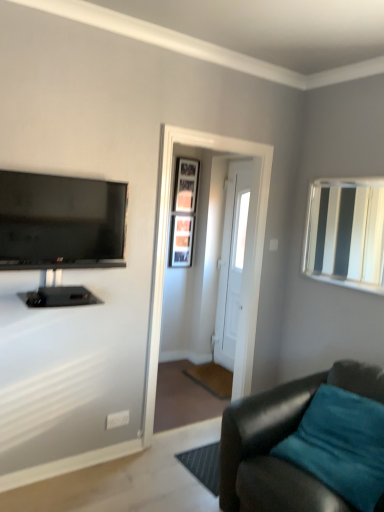
What do you see at coordinates (61, 222) in the screenshot?
I see `matte black tv at upper left` at bounding box center [61, 222].

You are a GUI agent. You are given a task and a screenshot of the screen. Output one action in this format:
    pyautogui.click(x=<x>, y=<y>)
    Task: Click on the teal leather couch at lower right
    
    Given the screenshot: What is the action you would take?
    pyautogui.click(x=281, y=440)

In order to face white glossy mirror at upper right, should I rotate leftwards or rightwards?

Turn right by 19.739 degrees to look at white glossy mirror at upper right.

Where is `white wooden door at center`? This screenshot has height=512, width=384. white wooden door at center is located at coordinates (232, 261).

You are a GUI agent. You are given a task and a screenshot of the screen. Output one action in this format:
    pyautogui.click(x=<x>, y=<y>)
    Task: Click on the matte black tv at upper left
    Image resolution: width=384 pixels, height=512 pixels.
    Given the screenshot: What is the action you would take?
    pyautogui.click(x=61, y=222)

You are a GUI agent. You are given a task and a screenshot of the screen. Output one action in this format:
    pyautogui.click(x=<x>, y=<y>)
    Task: Click on the screen door lying on the left of white glossy mirror at upper right
    The width and height of the screenshot is (384, 512).
    Given the screenshot: What is the action you would take?
    pyautogui.click(x=166, y=251)

Which is in front, point (153, 298) or point (383, 232)?

The point (153, 298) is closer.

Is white glossy door at center positioned beyond the bounds of white glossy mirror at upper right?

Yes, white glossy door at center is outside of white glossy mirror at upper right.

In the scene shown: Considering the sizes of objects white glossy door at center and white glossy mirror at upper right in the image provided, who is thinner, white glossy door at center or white glossy mirror at upper right?

white glossy mirror at upper right.

How far apart are teal leather couch at lower right and matte black tv at upper left?

teal leather couch at lower right is 1.30 meters away from matte black tv at upper left.

Is teal leather couch at lower right bigger than matte black tv at upper left?

Correct, teal leather couch at lower right is larger in size than matte black tv at upper left.

Locate an element on the screen. This screenshot has width=384, height=512. television above the teal leather couch at lower right (from a real-world perspective) is located at coordinates (61, 222).

Is wooden framed picture at center, which is the 2th picture frame in bottom-to-top order, directly adjacent to wooden picture frame at center, positioned as the first picture frame in bottom-to-top order?

No, wooden framed picture at center, which is the 2th picture frame in bottom-to-top order, is not making contact with wooden picture frame at center, positioned as the first picture frame in bottom-to-top order.

Which of these two, wooden framed picture at center, which is the 2th picture frame in bottom-to-top order, or wooden picture frame at center, positioned as the first picture frame in bottom-to-top order, stands taller?

wooden picture frame at center, positioned as the first picture frame in bottom-to-top order, is taller.

Is wooden framed picture at center, the 1th picture frame from the top, inside the boundaries of wooden picture frame at center, positioned as the first picture frame in bottom-to-top order, or outside?

wooden framed picture at center, the 1th picture frame from the top, is not inside wooden picture frame at center, positioned as the first picture frame in bottom-to-top order, it's outside.

From the image's perspective, is wooden framed picture at center, the 1th picture frame from the top, above or below wooden picture frame at center, which is the 2th picture frame from top to bottom?

Based on their image positions, wooden framed picture at center, the 1th picture frame from the top, is located above wooden picture frame at center, which is the 2th picture frame from top to bottom.

Is point (181, 179) closer or farther from the camera than point (311, 203)?

Clearly, point (181, 179) is more distant from the camera than point (311, 203).

How many degrees apart are the facing directions of wooden framed picture at center, which is the 2th picture frame in bottom-to-top order, and white glossy mirror at upper right?

91.1 degrees separate the facing orientations of wooden framed picture at center, which is the 2th picture frame in bottom-to-top order, and white glossy mirror at upper right.

Would you consider wooden framed picture at center, the 1th picture frame from the top, to be distant from white glossy mirror at upper right?

wooden framed picture at center, the 1th picture frame from the top, is positioned a significant distance from white glossy mirror at upper right.

Is wooden framed picture at center, which is the 2th picture frame in bottom-to-top order, positioned with its back to white glossy mirror at upper right?

No.

Considering the relative positions of white wooden door at center and white glossy mirror at upper right in the image provided, is white wooden door at center to the left or to the right of white glossy mirror at upper right?

Clearly, white wooden door at center is on the left of white glossy mirror at upper right in the image.

Is white wooden door at center oriented away from white glossy mirror at upper right?

No.

Is white glossy mirror at upper right located within white wooden door at center?

Definitely not — white glossy mirror at upper right is not inside white wooden door at center.

Does point (227, 263) come farther from viewer compared to point (321, 203)?

Yes, point (227, 263) is behind point (321, 203).

Is wooden framed picture at center, which is the 2th picture frame in bottom-to-top order, next to teal leather couch at lower right?

No.

From the image's perspective, which is above, wooden framed picture at center, which is the 2th picture frame in bottom-to-top order, or teal leather couch at lower right?

From the image's view, wooden framed picture at center, which is the 2th picture frame in bottom-to-top order, is above.

Between wooden framed picture at center, the 1th picture frame from the top, and teal leather couch at lower right, which one has larger width?

teal leather couch at lower right.

Visually, is wooden framed picture at center, which is the 2th picture frame in bottom-to-top order, positioned to the left or to the right of teal leather couch at lower right?

In the image, wooden framed picture at center, which is the 2th picture frame in bottom-to-top order, appears on the left side of teal leather couch at lower right.

From a real-world perspective, is teal leather couch at lower right positioned under white glossy mirror at upper right based on gravity?

Yes, from a real-world perspective, teal leather couch at lower right is under white glossy mirror at upper right.

How many degrees apart are the facing directions of teal leather couch at lower right and white glossy mirror at upper right?

The facing directions of teal leather couch at lower right and white glossy mirror at upper right are 4.48 degrees apart.

Between point (323, 375) and point (369, 289), which one is positioned in front?

The point (323, 375) is closer.

Is teal leather couch at lower right facing away from white glossy mirror at upper right?

No, teal leather couch at lower right is not facing away from white glossy mirror at upper right.

I want to click on mirror above the white glossy door at center (from the image's perspective), so click(346, 233).

Where is `studio couch located in front of the matte black tv at upper left`? studio couch located in front of the matte black tv at upper left is located at coordinates (281, 440).

Considering their positions, is wooden picture frame at center, positioned as the first picture frame in bottom-to-top order, positioned further to teal leather couch at lower right than white glossy door at center?

wooden picture frame at center, positioned as the first picture frame in bottom-to-top order, is further to teal leather couch at lower right.

When comparing their distances from white glossy door at center, does white wooden door at center or matte black tv at upper left seem further?

white wooden door at center is further to white glossy door at center.

Estimate the real-world distances between objects in this image. Which object is closer to matte black tv at upper left, teal leather couch at lower right or wooden framed picture at center, which is the 2th picture frame in bottom-to-top order?

teal leather couch at lower right is positioned closer to the anchor matte black tv at upper left.

Based on their spatial positions, is white glossy mirror at upper right or white wooden door at center further from wooden picture frame at center, which is the 2th picture frame from top to bottom?

Based on the image, white glossy mirror at upper right appears to be further to wooden picture frame at center, which is the 2th picture frame from top to bottom.

Estimate the real-world distances between objects in this image. Which object is further from teal leather couch at lower right, wooden framed picture at center, the 1th picture frame from the top, or matte black tv at upper left?

The object further to teal leather couch at lower right is wooden framed picture at center, the 1th picture frame from the top.

Which object lies nearer to the anchor point white glossy mirror at upper right, white glossy door at center or wooden picture frame at center, positioned as the first picture frame in bottom-to-top order?

white glossy door at center is positioned closer to the anchor white glossy mirror at upper right.

Based on the photo, when comparing their distances from matte black tv at upper left, does wooden framed picture at center, which is the 2th picture frame in bottom-to-top order, or wooden picture frame at center, which is the 2th picture frame from top to bottom, seem further?

wooden picture frame at center, which is the 2th picture frame from top to bottom, lies further to matte black tv at upper left than the other object.

Looking at the image, which one is located further to white wooden door at center, wooden framed picture at center, which is the 2th picture frame in bottom-to-top order, or white glossy door at center?

Among the two, white glossy door at center is located further to white wooden door at center.

At what (x,y) coordinates should I click in order to perform the action: click on screen door between white glossy mirror at upper right and wooden framed picture at center, which is the 2th picture frame in bottom-to-top order, along the z-axis. Please return your answer as a coordinate pair (x, y). This screenshot has height=512, width=384. Looking at the image, I should click on (166, 251).

Locate an element on the screen. The image size is (384, 512). picture frame between teal leather couch at lower right and wooden picture frame at center, which is the 2th picture frame from top to bottom, in the front-back direction is located at coordinates (186, 185).

Find the location of a particular element. The height and width of the screenshot is (512, 384). mirror between matte black tv at upper left and wooden picture frame at center, positioned as the first picture frame in bottom-to-top order, in the front-back direction is located at coordinates (346, 233).

Locate an element on the screen. Image resolution: width=384 pixels, height=512 pixels. door between teal leather couch at lower right and wooden framed picture at center, the 1th picture frame from the top, from front to back is located at coordinates (232, 261).